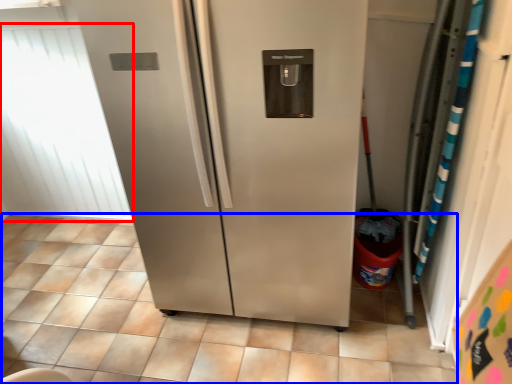
Question: Among these objects, which one is farthest to the camera, window screen (highlighted by a red box) or tile (highlighted by a blue box)?

Choices:
 (A) window screen
 (B) tile

Answer: (A)